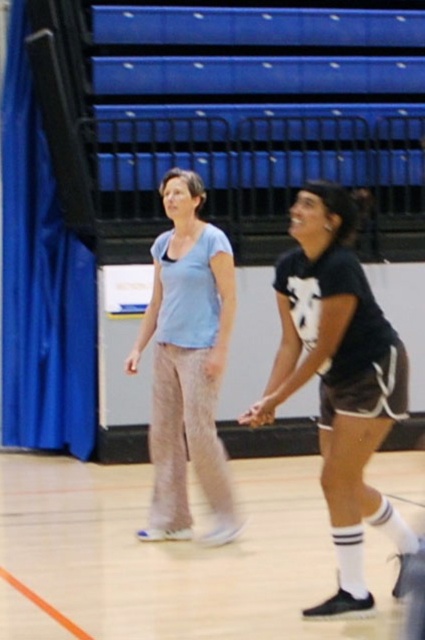
In the scene shown: Is black matte shorts at center above light blue cotton shirt at center?

No.

Between point (351, 248) and point (172, 456), which one is positioned behind?

Point (351, 248)

Image resolution: width=425 pixels, height=640 pixels. What are the coordinates of `black matte shorts at center` in the screenshot? It's located at (339, 380).

Is white rubber shoes at lower center shorter than light blue cotton shirt at center?

Indeed, white rubber shoes at lower center has a lesser height compared to light blue cotton shirt at center.

Is white rubber shoes at lower center wider than light blue cotton shirt at center?

Indeed, white rubber shoes at lower center has a greater width compared to light blue cotton shirt at center.

The height and width of the screenshot is (640, 425). Describe the element at coordinates (181, 554) in the screenshot. I see `white rubber shoes at lower center` at that location.

You are a GUI agent. You are given a task and a screenshot of the screen. Output one action in this format:
    pyautogui.click(x=<x>, y=<y>)
    Task: Click on the white rubber shoes at lower center
    Image resolution: width=425 pixels, height=640 pixels.
    Given the screenshot: What is the action you would take?
    pyautogui.click(x=181, y=554)

Does point (260, 500) lie in front of point (360, 468)?

No, (260, 500) is behind (360, 468).

Is white rubber shoes at lower center above black matte shorts at center?

No, white rubber shoes at lower center is not above black matte shorts at center.

This screenshot has width=425, height=640. What are the coordinates of `white rubber shoes at lower center` in the screenshot? It's located at (181, 554).